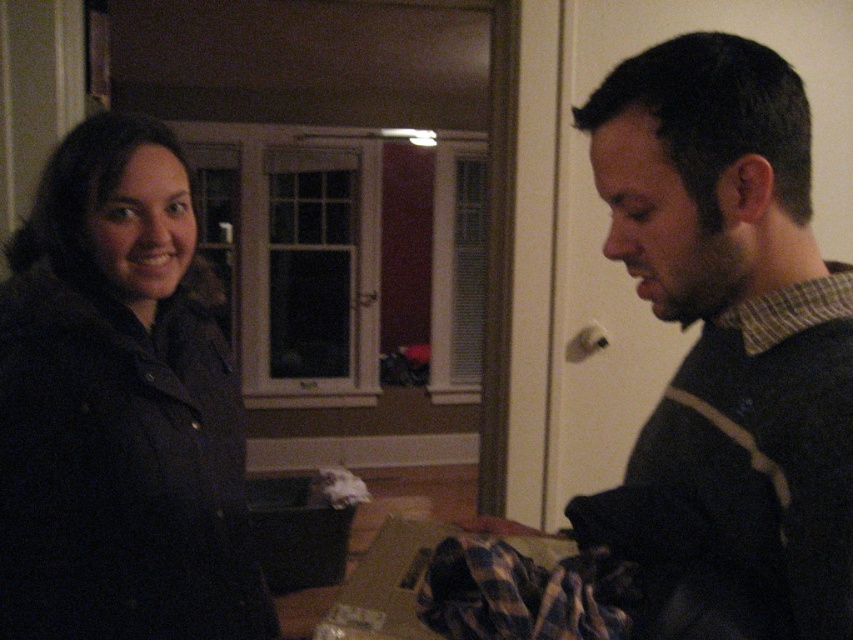
How much distance is there between dark brown sweater at right and dark matte jacket at left?

They are 58.58 centimeters apart.

Is point (705, 531) farther from camera compared to point (221, 536)?

No, (705, 531) is closer to viewer.

Locate an element on the screen. Image resolution: width=853 pixels, height=640 pixels. dark brown sweater at right is located at coordinates (729, 328).